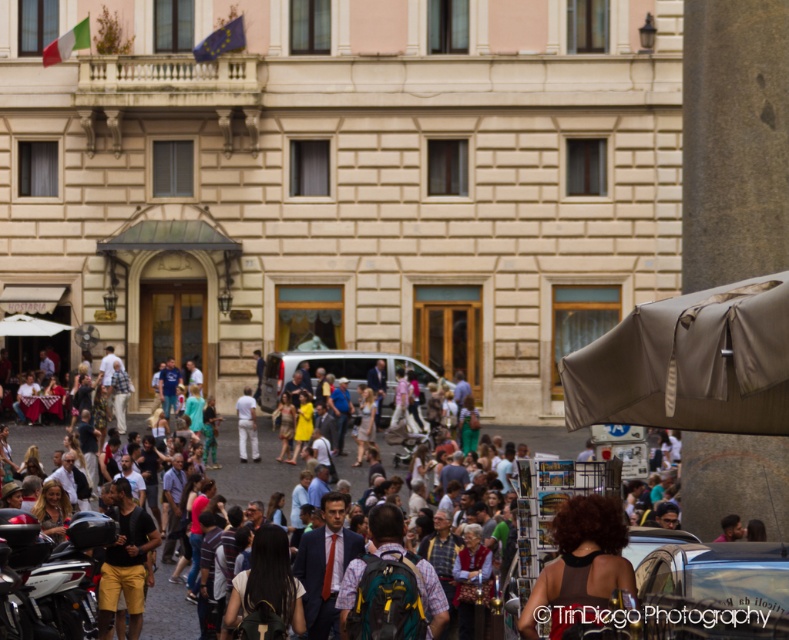
Question: Which of the following is the closest to the observer?

Choices:
 (A) white cotton pants at center
 (B) yellow shorts at center
 (C) white fabric umbrella at lower left
 (D) dark brown curly hair at lower center

Answer: (D)

Question: Can you confirm if silver metallic motorcycle at lower left is bigger than green fabric backpack at center?

Choices:
 (A) no
 (B) yes

Answer: (B)

Question: Which object appears farthest from the camera in this image?

Choices:
 (A) dark brown hair at center
 (B) dark brown curly hair at lower center

Answer: (A)

Question: Can you confirm if matte brown umbrella at center is wider than white cotton pants at center?

Choices:
 (A) no
 (B) yes

Answer: (B)

Question: Estimate the real-world distances between objects in this image. Which object is farther from the green fabric backpack at center?

Choices:
 (A) silver metallic motorcycle at lower left
 (B) white fabric umbrella at lower left
 (C) white cotton pants at center

Answer: (B)

Question: Is matte brown umbrella at center to the left of dark brown hair at center from the viewer's perspective?

Choices:
 (A) yes
 (B) no

Answer: (A)